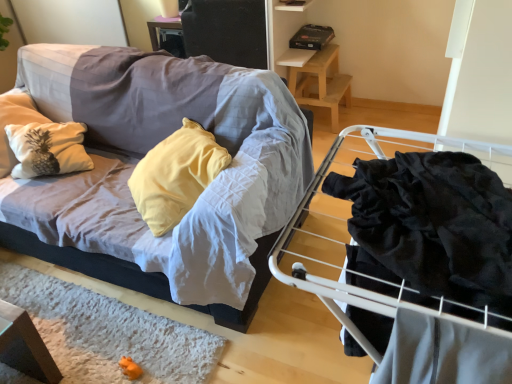
Measure the distance between black velvet fabric at right and camera.

black velvet fabric at right and camera are 21.42 inches apart.

The height and width of the screenshot is (384, 512). What do you see at coordinates (321, 82) in the screenshot?
I see `wooden stool at upper right` at bounding box center [321, 82].

This screenshot has width=512, height=384. Find the location of `textured fabric couch at left`. textured fabric couch at left is located at coordinates (143, 155).

This screenshot has width=512, height=384. Identify the location of furniture that appears on the right of textured fabric couch at left. (344, 243).

From the picture: Does textured fabric couch at left have a lesser width compared to black velvet fabric at right?

No.

From a real-world perspective, which object rests below the other?

In real-world perspective, textured fabric couch at left is lower.

Could you tell me if textured fabric couch at left is facing black velvet fabric at right?

No, textured fabric couch at left is not facing towards black velvet fabric at right.

Does textured fabric couch at left turn towards wooden stool at upper right?

No, textured fabric couch at left is not aimed at wooden stool at upper right.

Is textured fabric couch at left directly adjacent to wooden stool at upper right?

No, textured fabric couch at left is not in contact with wooden stool at upper right.

From a real-world perspective, is textured fabric couch at left positioned over wooden stool at upper right based on gravity?

Yes.

Is wooden stool at upper right completely or partially inside textured fabric couch at left?

No.

From the image's perspective, is wooden stool at upper right under black velvet fabric at right?

No, from the image's perspective, wooden stool at upper right is not beneath black velvet fabric at right.

Can you confirm if wooden stool at upper right is wider than black velvet fabric at right?

In fact, wooden stool at upper right might be narrower than black velvet fabric at right.

From a real-world perspective, does wooden stool at upper right stand above black velvet fabric at right?

Actually, wooden stool at upper right is physically below black velvet fabric at right in the real world.

Does wooden stool at upper right turn towards black velvet fabric at right?

No, wooden stool at upper right does not turn towards black velvet fabric at right.

At what (x,y) coordinates should I click in order to perform the action: click on studio couch on the left of black velvet fabric at right. Please return your answer as a coordinate pair (x, y). The height and width of the screenshot is (384, 512). Looking at the image, I should click on (143, 155).

From a real-world perspective, is black velvet fabric at right over textured fabric couch at left?

→ Yes, from a real-world perspective, black velvet fabric at right is over textured fabric couch at left

What's the angular difference between black velvet fabric at right and textured fabric couch at left's facing directions?

1.34 degrees.

Is black velvet fabric at right in contact with textured fabric couch at left?

black velvet fabric at right is not next to textured fabric couch at left, and they're not touching.

From the picture: Considering the sizes of objects black velvet fabric at right and wooden stool at upper right in the image provided, who is thinner, black velvet fabric at right or wooden stool at upper right?

wooden stool at upper right is thinner.

From a real-world perspective, which object stands above the other?

black velvet fabric at right is physically above.

Between black velvet fabric at right and wooden stool at upper right, which one appears on the right side from the viewer's perspective?

From the viewer's perspective, wooden stool at upper right appears more on the right side.

Locate an element on the screen. table located on the right of black velvet fabric at right is located at coordinates click(321, 82).

Is wooden stool at upper right not close to textured fabric couch at left?

Absolutely, wooden stool at upper right is distant from textured fabric couch at left.

Considering the relative positions of wooden stool at upper right and textured fabric couch at left in the image provided, is wooden stool at upper right to the left or to the right of textured fabric couch at left?

In the image, wooden stool at upper right appears on the right side of textured fabric couch at left.

Based on the photo, from their relative heights in the image, would you say wooden stool at upper right is taller or shorter than textured fabric couch at left?

In the image, wooden stool at upper right appears to be shorter than textured fabric couch at left.

From a real-world perspective, who is located higher, wooden stool at upper right or textured fabric couch at left?

textured fabric couch at left is physically above.

The width and height of the screenshot is (512, 384). In the image, there is a black velvet fabric at right. What are the coordinates of `studio couch below it (from a real-world perspective)` in the screenshot? It's located at (143, 155).

There is a wooden stool at upper right. Identify the location of studio couch above it (from a real-world perspective). pos(143,155).

Which object lies nearer to the anchor point wooden stool at upper right, black velvet fabric at right or textured fabric couch at left?

textured fabric couch at left is positioned closer to the anchor wooden stool at upper right.

Looking at the image, which one is located closer to wooden stool at upper right, textured fabric couch at left or black velvet fabric at right?

textured fabric couch at left.

Estimate the real-world distances between objects in this image. Which object is closer to textured fabric couch at left, black velvet fabric at right or wooden stool at upper right?

black velvet fabric at right.

Considering their positions, is wooden stool at upper right positioned closer to textured fabric couch at left than black velvet fabric at right?

Among the two, black velvet fabric at right is located nearer to textured fabric couch at left.

Looking at this image, which object lies further to the anchor point black velvet fabric at right, wooden stool at upper right or textured fabric couch at left?

wooden stool at upper right is positioned further to the anchor black velvet fabric at right.

Estimate the real-world distances between objects in this image. Which object is further from black velvet fabric at right, textured fabric couch at left or wooden stool at upper right?

wooden stool at upper right lies further to black velvet fabric at right than the other object.

The height and width of the screenshot is (384, 512). I want to click on studio couch between black velvet fabric at right and wooden stool at upper right along the z-axis, so click(x=143, y=155).